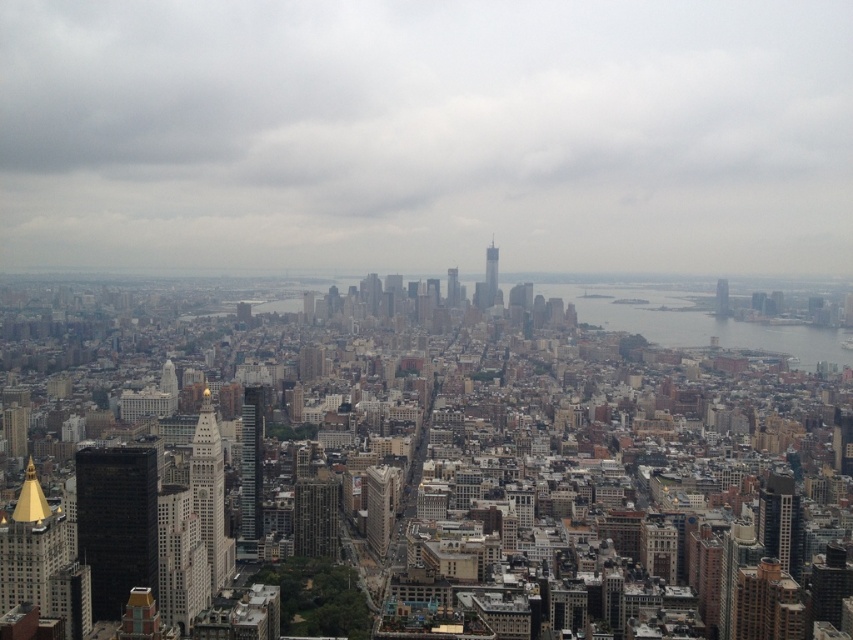
Which of these two, silver metallic skyscraper at center-left or dark gray concrete skyscraper at lower right, stands shorter?

dark gray concrete skyscraper at lower right

Which is more to the left, silver metallic skyscraper at center-left or dark gray concrete skyscraper at lower right?

silver metallic skyscraper at center-left is more to the left.

Who is more forward, (218,444) or (792,560)?

Point (218,444) is more forward.

Identify the location of silver metallic skyscraper at center-left. (x=210, y=493).

Does silver metallic skyscraper at center-left appear on the right side of gray concrete skyscraper at center?

Incorrect, silver metallic skyscraper at center-left is not on the right side of gray concrete skyscraper at center.

Does silver metallic skyscraper at center-left come in front of gray concrete skyscraper at center?

No.

Image resolution: width=853 pixels, height=640 pixels. In order to click on silver metallic skyscraper at center-left in this screenshot , I will do coord(210,493).

Does green glass building at center appear on the right side of glassy steel skyscraper at center?

Incorrect, green glass building at center is not on the right side of glassy steel skyscraper at center.

Between green glass building at center and glassy steel skyscraper at center, which one has more height?

Standing taller between the two is green glass building at center.

Locate an element on the screen. green glass building at center is located at coordinates (315, 516).